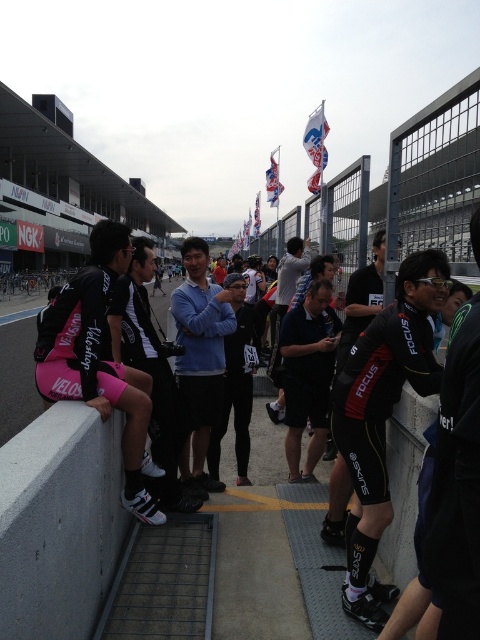
Is black matte cycling suit at center wider than pink fabric shorts at left?

Incorrect, black matte cycling suit at center's width does not surpass pink fabric shorts at left's.

Is black matte cycling suit at center thinner than pink fabric shorts at left?

Indeed, black matte cycling suit at center has a lesser width compared to pink fabric shorts at left.

Does point (372, 452) lie behind point (74, 324)?

No, (372, 452) is in front of (74, 324).

The width and height of the screenshot is (480, 640). Find the location of `black matte cycling suit at center`. black matte cycling suit at center is located at coordinates (383, 417).